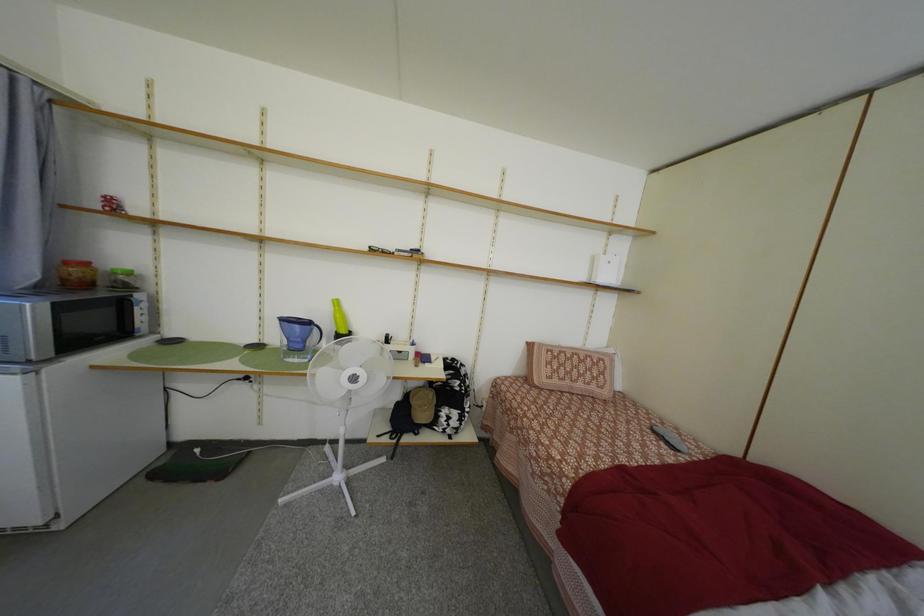
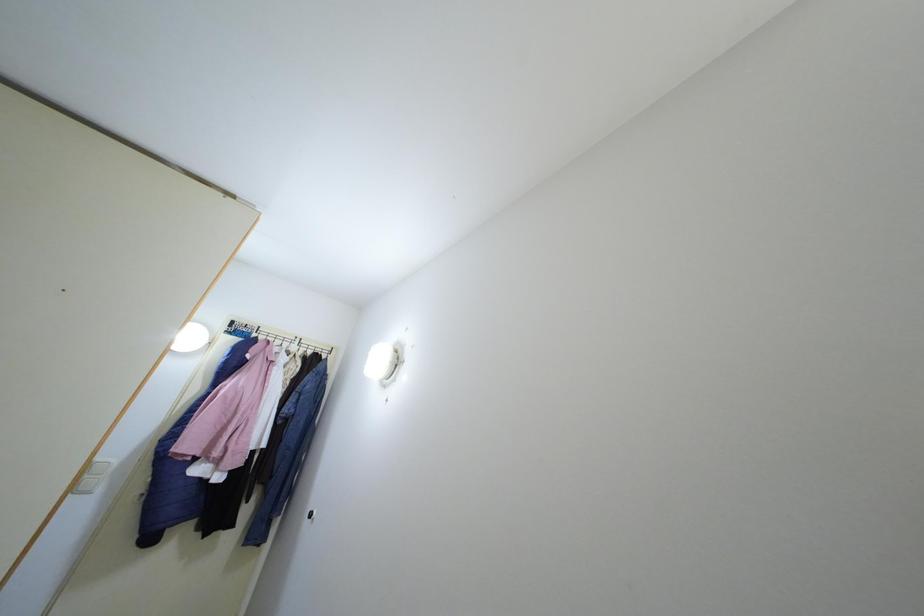
Question: The camera is either moving clockwise (left) or counter-clockwise (right) around the object. The first image is from the beginning of the video and the second image is from the end. Is the camera moving left or right when shooting the video?

Choices:
 (A) Left
 (B) Right

Answer: (A)